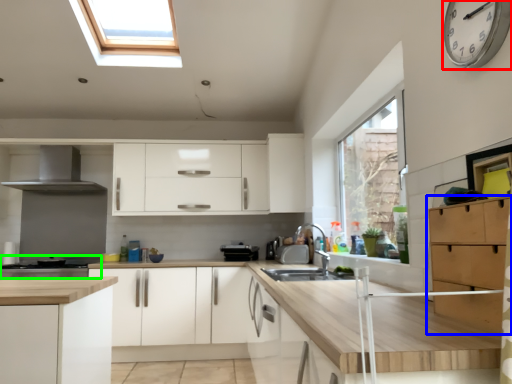
Question: Which object is positioned farthest from clock (highlighted by a red box)? Select from cabinetry (highlighted by a blue box) and home appliance (highlighted by a green box).

Choices:
 (A) cabinetry
 (B) home appliance

Answer: (B)